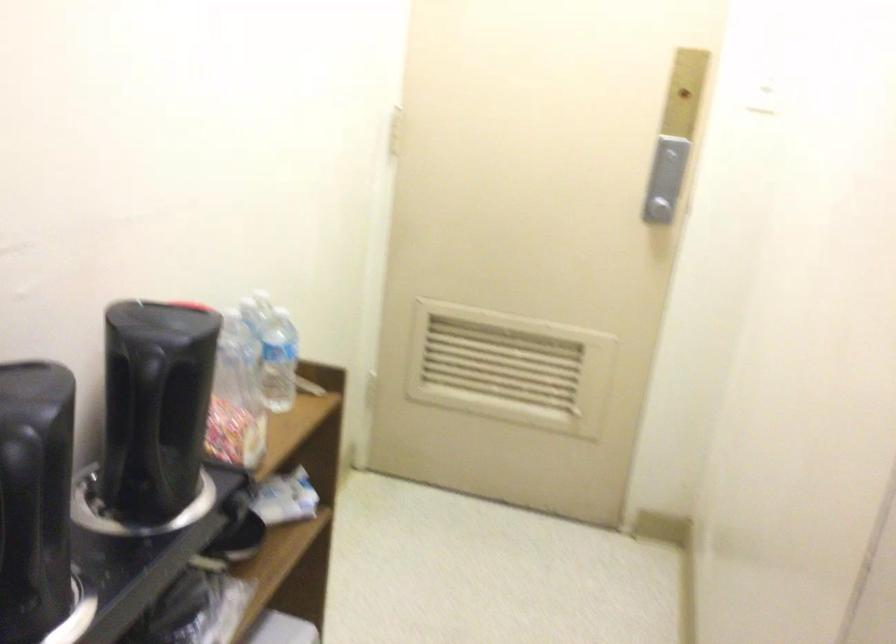
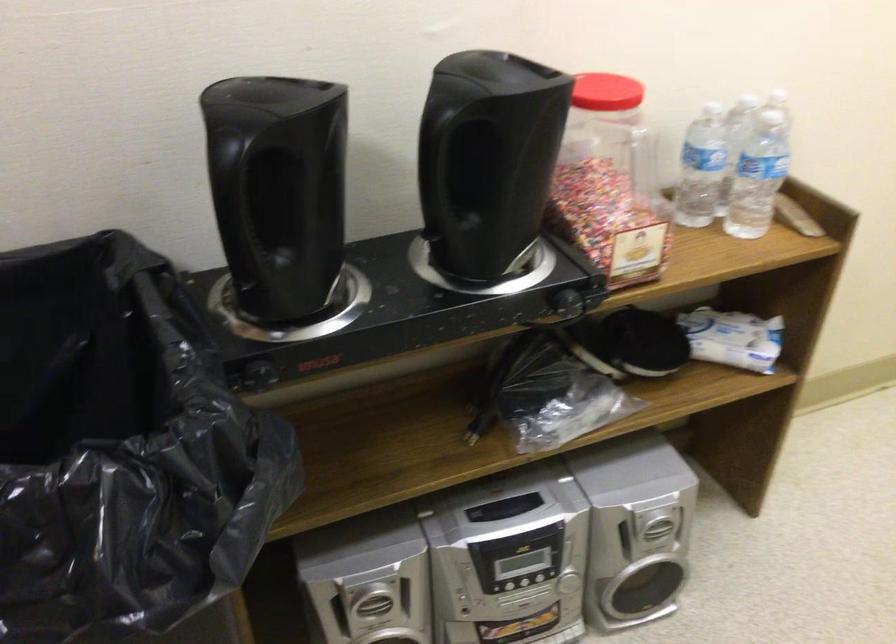
The point at (194, 323) is marked in the first image. Where is the corresponding point in the second image?

(606, 91)